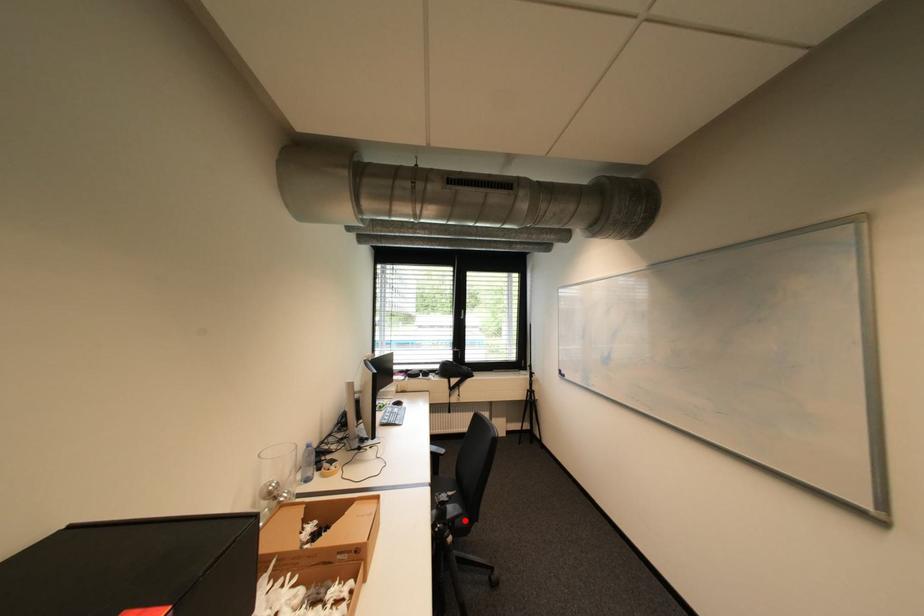
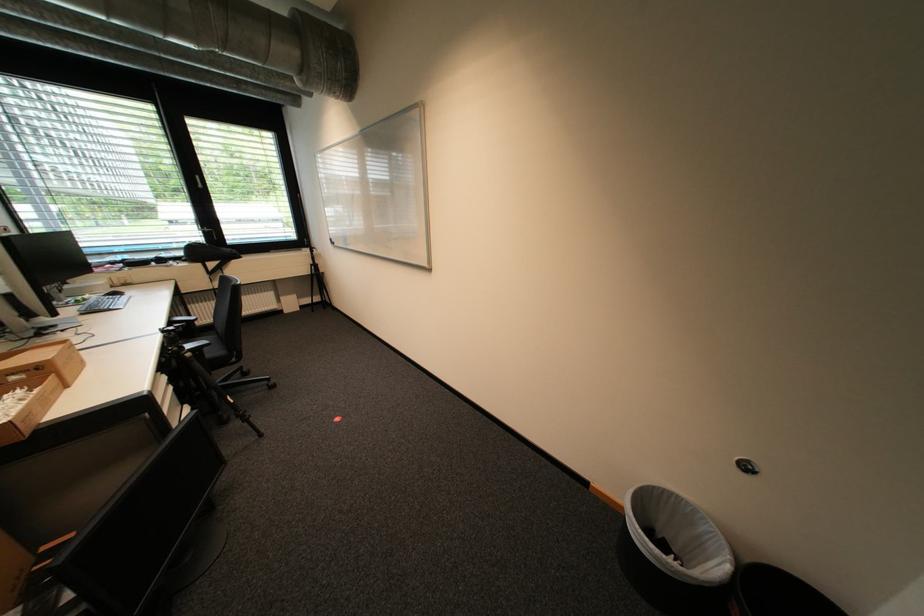
Where in the second image is the point corresponding to the highlighted location from the first image?

(213, 350)